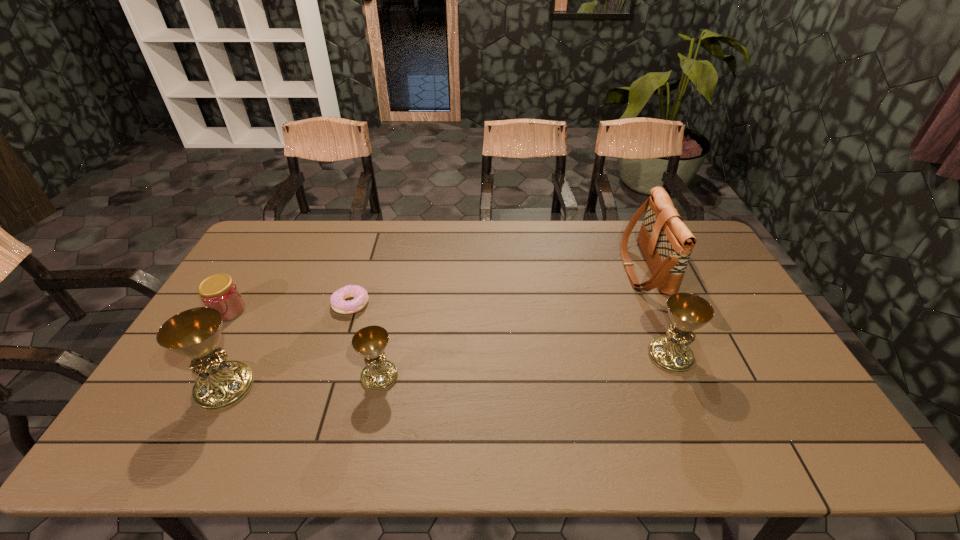
Find the location of a particular element. The image size is (960, 540). vacant area between the shortest chalice and the tallest chalice is located at coordinates (302, 381).

Locate an element on the screen. The width and height of the screenshot is (960, 540). empty location between the tallest chalice and the third object from left to right is located at coordinates coord(288,346).

Identify which object is the second nearest to the shoulder bag. Please provide its 2D coordinates. Your answer should be formatted as a tuple, i.e. [(x, y)], where the tuple contains the x and y coordinates of a point satisfying the conditions above.

[(371, 341)]

Locate which object ranks fourth in proximity to the fifth tallest object. Please provide its 2D coordinates. Your answer should be formatted as a tuple, i.e. [(x, y)], where the tuple contains the x and y coordinates of a point satisfying the conditions above.

[(688, 312)]

Identify which chalice is the second nearest to the second shortest chalice. Please provide its 2D coordinates. Your answer should be formatted as a tuple, i.e. [(x, y)], where the tuple contains the x and y coordinates of a point satisfying the conditions above.

[(195, 333)]

Point out which chalice is positioned as the second nearest to the second tallest chalice. Please provide its 2D coordinates. Your answer should be formatted as a tuple, i.e. [(x, y)], where the tuple contains the x and y coordinates of a point satisfying the conditions above.

[(195, 333)]

Locate an element on the screen. free space that satisfies the following two spatial constraints: 1. on the front-facing side of the shoulder bag; 2. on the front side of the leftmost chalice is located at coordinates (697, 387).

The image size is (960, 540). I want to click on vacant space that satisfies the following two spatial constraints: 1. on the back side of the shortest chalice; 2. on the right side of the leftmost chalice, so click(230, 376).

Where is `free spot that satisfies the following two spatial constraints: 1. on the back side of the leftmost chalice; 2. on the right side of the shortest object`? The image size is (960, 540). free spot that satisfies the following two spatial constraints: 1. on the back side of the leftmost chalice; 2. on the right side of the shortest object is located at coordinates (267, 304).